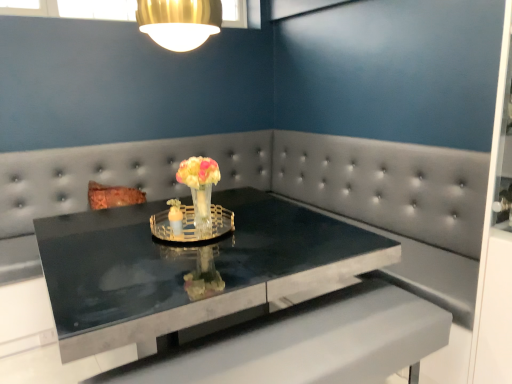
In order to click on free space to the right of clear glass candle holder at center, acting as the second candle holder starting from the left in this screenshot , I will do `click(272, 235)`.